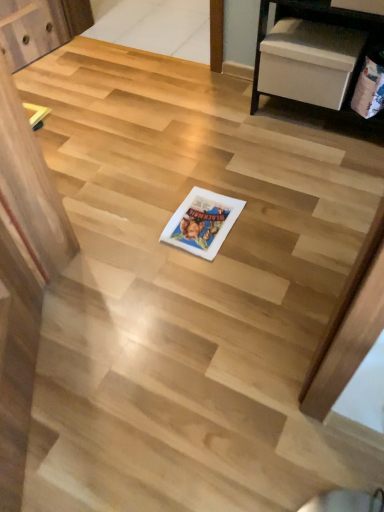
This screenshot has width=384, height=512. What are the coordinates of `free spot in front of matte paper comic book at right, positioned as the second comic book in left-to-right order` in the screenshot? It's located at (366, 157).